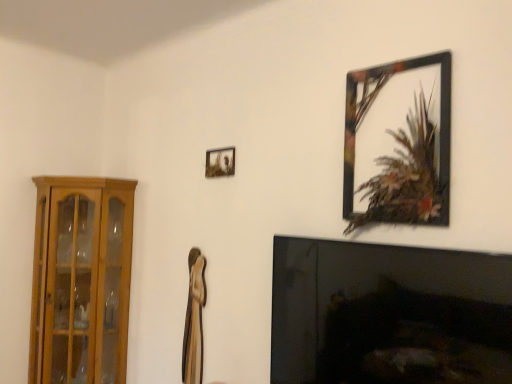
Question: From the image's perspective, would you say wooden cabinet at left is shown under black glass fireplace at lower right?

Choices:
 (A) no
 (B) yes

Answer: (B)

Question: Could you tell me if wooden cabinet at left is facing black glass fireplace at lower right?

Choices:
 (A) yes
 (B) no

Answer: (A)

Question: Is wooden cabinet at left directly adjacent to black glass fireplace at lower right?

Choices:
 (A) no
 (B) yes

Answer: (A)

Question: From the image's perspective, does wooden cabinet at left appear higher than black glass fireplace at lower right?

Choices:
 (A) no
 (B) yes

Answer: (A)

Question: From a real-world perspective, does wooden cabinet at left sit lower than black glass fireplace at lower right?

Choices:
 (A) no
 (B) yes

Answer: (B)

Question: Is wooden cabinet at left not near black glass fireplace at lower right?

Choices:
 (A) no
 (B) yes

Answer: (B)

Question: Does metallic black picture frame at upper right, the first picture frame viewed from the front, appear on the right side of metallic silver photo frame at upper center, placed as the first picture frame when sorted from back to front?

Choices:
 (A) no
 (B) yes

Answer: (B)

Question: Is metallic black picture frame at upper right, which is the second picture frame in left-to-right order, to the left of metallic silver photo frame at upper center, placed as the first picture frame when sorted from back to front, from the viewer's perspective?

Choices:
 (A) yes
 (B) no

Answer: (B)

Question: Is metallic black picture frame at upper right, which is the second picture frame in left-to-right order, positioned in front of metallic silver photo frame at upper center, the second picture frame viewed from the front?

Choices:
 (A) no
 (B) yes

Answer: (B)

Question: Is metallic black picture frame at upper right, the first picture frame viewed from the front, oriented towards metallic silver photo frame at upper center, which appears as the 2th picture frame when viewed from the right?

Choices:
 (A) no
 (B) yes

Answer: (A)

Question: From a real-world perspective, is metallic black picture frame at upper right, which is the first picture frame in right-to-left order, located beneath metallic silver photo frame at upper center, which appears as the 2th picture frame when viewed from the right?

Choices:
 (A) no
 (B) yes

Answer: (A)

Question: From the image's perspective, would you say metallic black picture frame at upper right, the 2th picture frame when ordered from back to front, is shown under metallic silver photo frame at upper center, which appears as the 2th picture frame when viewed from the right?

Choices:
 (A) no
 (B) yes

Answer: (A)

Question: Is wooden cabinet at left located within metallic silver photo frame at upper center, which appears as the 2th picture frame when viewed from the right?

Choices:
 (A) yes
 (B) no

Answer: (B)